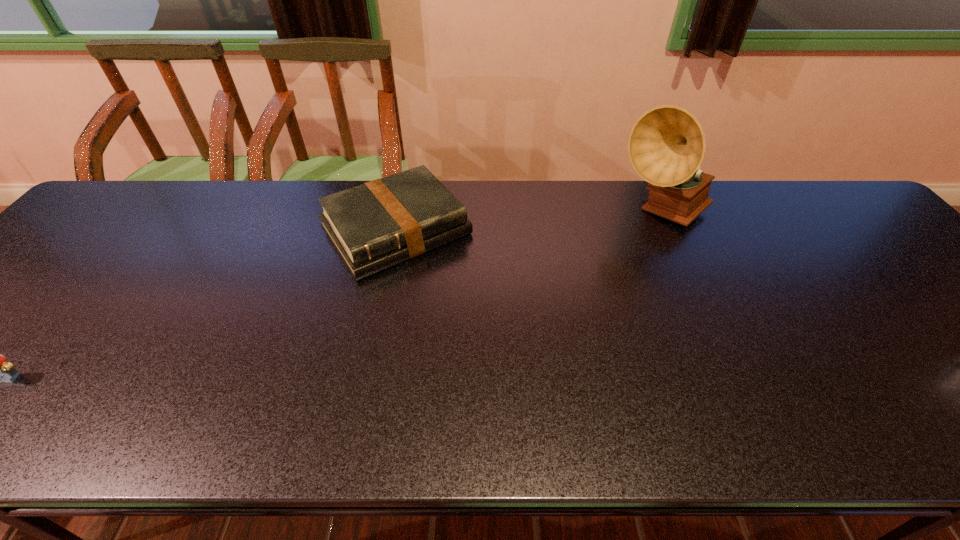
At what (x,y) coordinates should I click in order to perform the action: click on the second object from left to right. Please return your answer as a coordinate pair (x, y). Looking at the image, I should click on (381, 223).

This screenshot has height=540, width=960. I want to click on hardback book, so click(381, 223).

At what (x,y) coordinates should I click in order to perform the action: click on the rightmost object. Please return your answer as a coordinate pair (x, y). Looking at the image, I should click on (666, 146).

This screenshot has width=960, height=540. In order to click on phonograph record in this screenshot , I will do `click(666, 146)`.

The image size is (960, 540). In order to click on blank area located on the spine side of the shortest object in this screenshot , I will do `click(444, 286)`.

I want to click on free space located 0.220m on the spine side of the shortest object, so click(x=481, y=333).

Find the location of `vacant position located on the spine side of the shortest object`. vacant position located on the spine side of the shortest object is located at coordinates (476, 327).

Locate an element on the screen. The width and height of the screenshot is (960, 540). vacant space positioned on the horn of the phonograph record is located at coordinates (649, 344).

In order to click on blank area located 0.320m on the horn of the phonograph record in this screenshot , I will do `click(650, 330)`.

Identify the location of free space located 0.060m on the horn of the phonograph record. (657, 255).